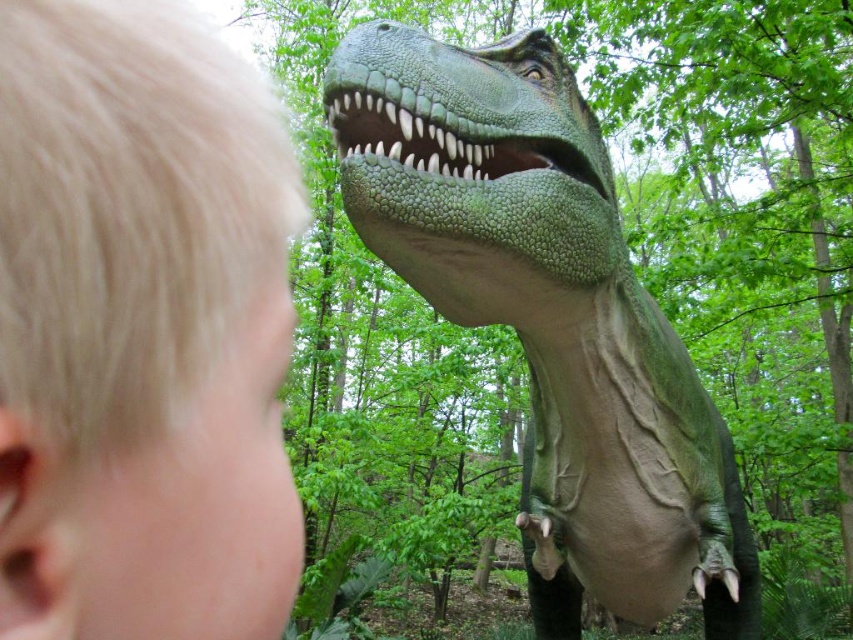
Can you confirm if blonde hair at upper left is wider than green scaly dinosaur at center?

In fact, blonde hair at upper left might be narrower than green scaly dinosaur at center.

Which is behind, point (289, 586) or point (572, 163)?

The point (572, 163) is behind.

You are a GUI agent. You are given a task and a screenshot of the screen. Output one action in this format:
    pyautogui.click(x=<x>, y=<y>)
    Task: Click on the blonde hair at upper left
    The width and height of the screenshot is (853, 640).
    Given the screenshot: What is the action you would take?
    pyautogui.click(x=141, y=328)